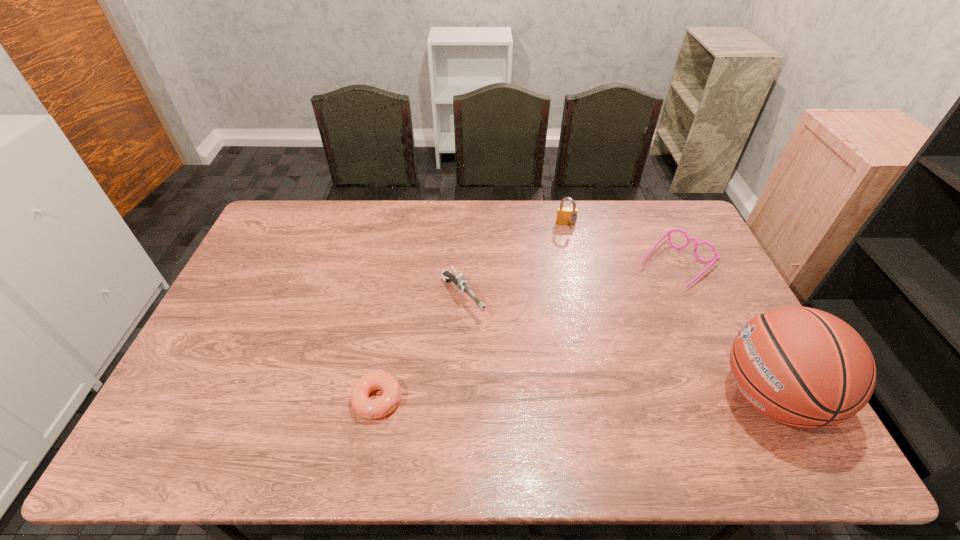
The width and height of the screenshot is (960, 540). I want to click on vacant space positioned on the logo side of the basketball, so click(x=647, y=396).

Locate an element on the screen. free spot located 0.340m on the logo side of the basketball is located at coordinates (585, 396).

Identify the location of vacant space located on the side with the combination dials of the fourth shortest object. This screenshot has width=960, height=540. (574, 271).

Locate an element on the screen. free region located 0.110m on the side with the combination dials of the fourth shortest object is located at coordinates pos(570,249).

Where is `free spot located on the side with the combination dials of the fourth shortest object`? free spot located on the side with the combination dials of the fourth shortest object is located at coordinates (575, 278).

Where is `blank area located aimed along the barrel of the gun`? blank area located aimed along the barrel of the gun is located at coordinates (516, 366).

Find the location of `free location located 0.340m aimed along the barrel of the gun`. free location located 0.340m aimed along the barrel of the gun is located at coordinates (549, 405).

The image size is (960, 540). Find the location of `free spot located 0.250m aimed along the barrel of the gun`. free spot located 0.250m aimed along the barrel of the gun is located at coordinates (527, 380).

Find the location of `vacant area situated on the arms of the spectacles`. vacant area situated on the arms of the spectacles is located at coordinates (595, 343).

You are a GUI agent. You are given a task and a screenshot of the screen. Output one action in this format:
    pyautogui.click(x=<x>, y=<y>)
    Task: Click on the vacant position located on the arms of the spectacles
    The height and width of the screenshot is (540, 960).
    Given the screenshot: What is the action you would take?
    click(618, 321)